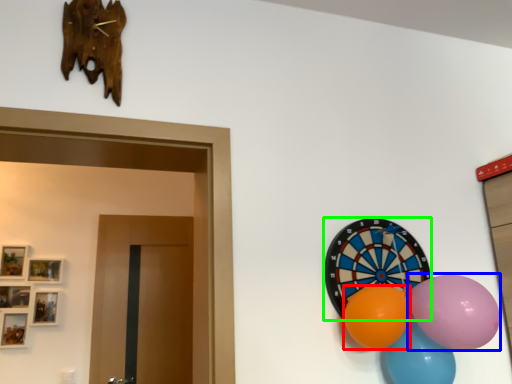
Question: Estimate the real-world distances between objects in this image. Which object is closer to balloon (highlighted by a red box), balloon (highlighted by a blue box) or oval (highlighted by a green box)?

Choices:
 (A) balloon
 (B) oval

Answer: (A)